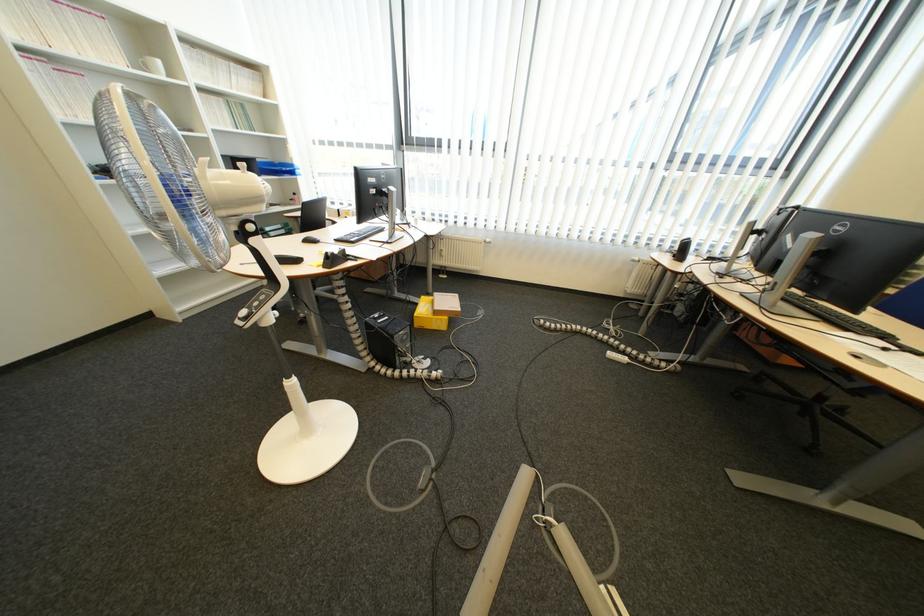
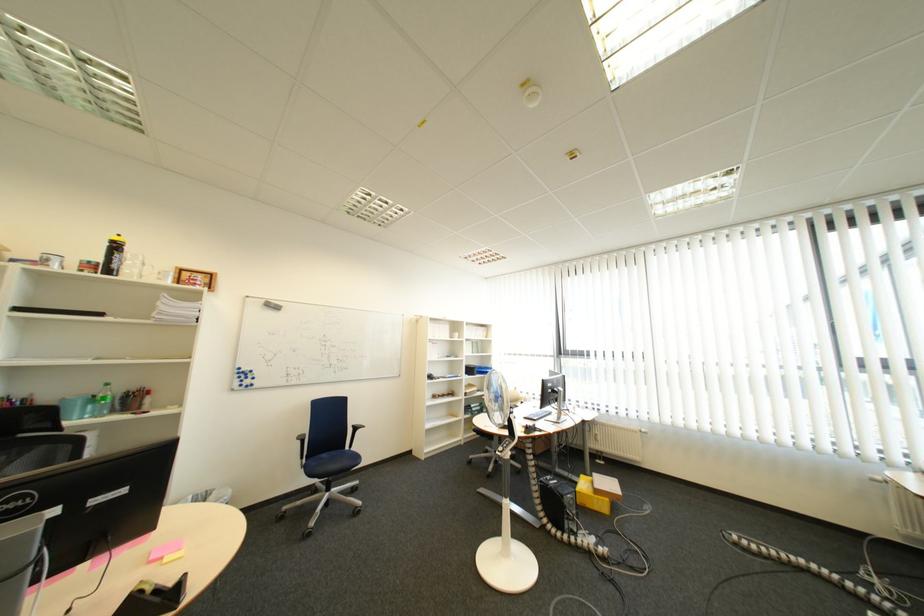
The point at (387, 260) is marked in the first image. Where is the corresponding point in the second image?

(565, 434)